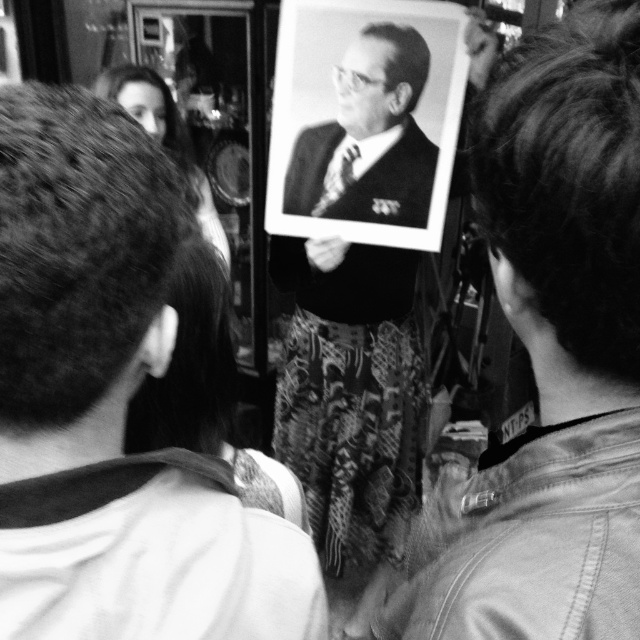
Question: Which of the following is the farthest from the observer?

Choices:
 (A) (65, 612)
 (B) (300, 433)

Answer: (B)

Question: Which of the following is the farthest from the observer?

Choices:
 (A) black textured suit at center
 (B) smooth skin face at upper left
 (C) smooth suit at center
 (D) smooth black suit at center

Answer: (B)

Question: Does smooth fabric jacket at center have a greater width compared to black textured suit at center?

Choices:
 (A) no
 (B) yes

Answer: (A)

Question: Is smooth fabric jacket at center wider than smooth suit at center?

Choices:
 (A) yes
 (B) no

Answer: (A)

Question: Observing the image, what is the correct spatial positioning of smooth suit at center in reference to smooth skin face at upper left?

Choices:
 (A) left
 (B) right

Answer: (B)

Question: Which of the following is the closest to the observer?

Choices:
 (A) smooth black suit at center
 (B) smooth fabric jacket at center
 (C) smooth suit at center
 (D) smooth skin face at upper left

Answer: (B)